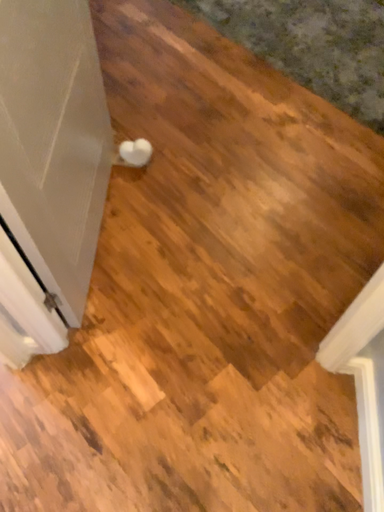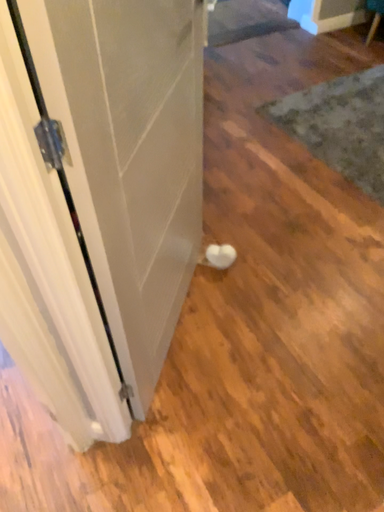
Question: How did the camera likely rotate when shooting the video?

Choices:
 (A) rotated right
 (B) rotated left

Answer: (B)